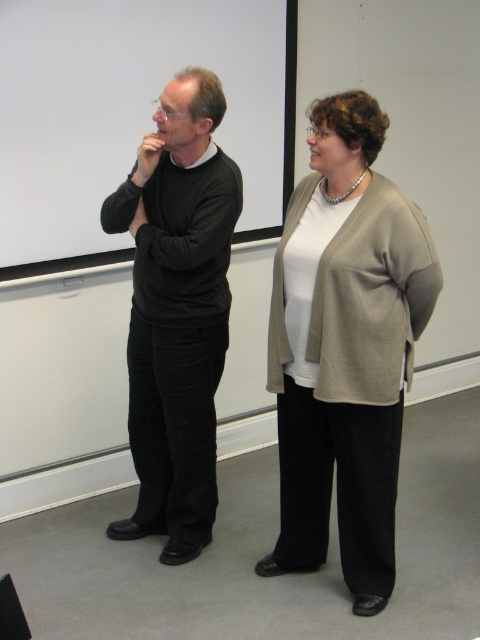
You are standing in a presentation room and see the beige sweater at center. If you want to reach it without moving your feet, can you do it?

The beige sweater at center is 1.95 meters away from viewer, so you cannot reach it without moving your feet since it is too far.

You are organizing a small presentation and need to ensure that the white matte projection screen at upper center and the black ribbed sweater at left are both visible to the audience. Given their sizes, which object will likely be more noticeable to the audience?

The white matte projection screen at upper center is bigger than the black ribbed sweater at left, so it will likely be more noticeable to the audience.

You are standing in the room and want to point to the exact location of the point at coordinates (345,348). According to the scene description, which object would your finger be pointing at?

The point at coordinates (345,348) is on the beige sweater at center, so your finger would be pointing at the beige sweater at center.